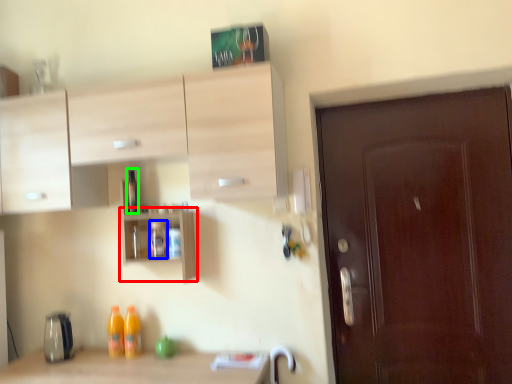
Question: Which object is positioned closest to shelf (highlighted by a red box)? Select from bottle (highlighted by a blue box) and bottle (highlighted by a green box).

Choices:
 (A) bottle
 (B) bottle

Answer: (A)